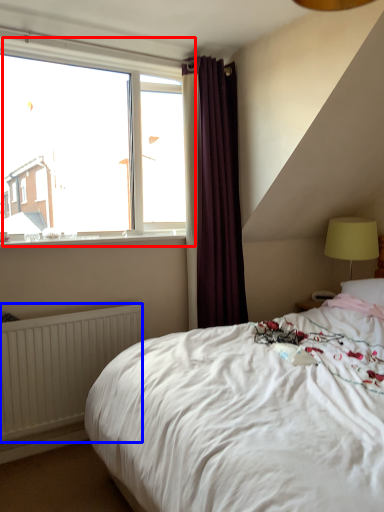
Question: Which object appears closest to the camera in this image, window (highlighted by a red box) or radiator (highlighted by a blue box)?

Choices:
 (A) window
 (B) radiator

Answer: (B)